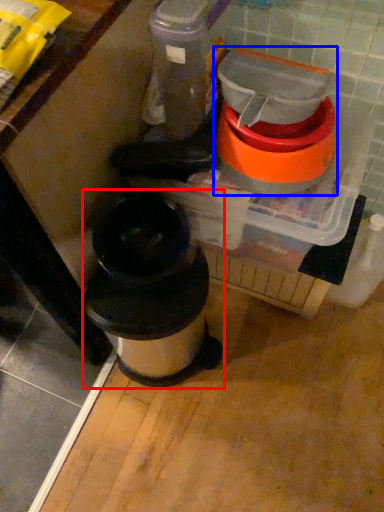
Question: Which of the following is the closest to the observer, waste container (highlighted by a red box) or appliance (highlighted by a blue box)?

Choices:
 (A) waste container
 (B) appliance

Answer: (B)